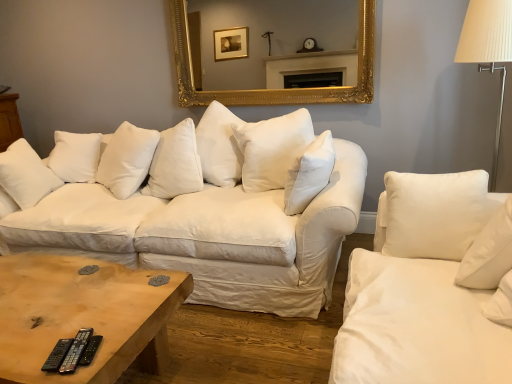
Consider the image. Measure the distance between wooden coffee table at center and camera.

wooden coffee table at center is 1.25 meters from camera.

What do you see at coordinates (127, 159) in the screenshot? This screenshot has height=384, width=512. I see `white soft pillow at center, the 1th pillow positioned from the left` at bounding box center [127, 159].

The image size is (512, 384). Describe the element at coordinates (90, 350) in the screenshot. I see `black plastic remote at lower left, which is counted as the 1th remote, starting from the right` at that location.

Describe the element at coordinates (273, 90) in the screenshot. The height and width of the screenshot is (384, 512). I see `gold ornate mirror at upper center` at that location.

Describe the element at coordinates (488, 50) in the screenshot. I see `white fabric lampshade at right` at that location.

Where is `wooden coffee table at center`? wooden coffee table at center is located at coordinates (83, 315).

How far apart are white fabric lampshade at right and wooden coffee table at center?

white fabric lampshade at right is 6.65 feet away from wooden coffee table at center.

Between white fabric lampshade at right and wooden coffee table at center, which one has smaller size?

Smaller between the two is white fabric lampshade at right.

Image resolution: width=512 pixels, height=384 pixels. In the image, there is a white fabric lampshade at right. In order to click on coffee table below it (from a real-world perspective) in this screenshot , I will do `click(83, 315)`.

Is white fabric lampshade at right situated inside wooden coffee table at center or outside?

white fabric lampshade at right is not inside wooden coffee table at center, it's outside.

Is white cotton couch at center placed right next to black rubber remote at lower left, the second remote in the right-to-left sequence?

white cotton couch at center and black rubber remote at lower left, the second remote in the right-to-left sequence, are clearly separated.

Based on the photo, is white cotton couch at center spatially inside black rubber remote at lower left, the second remote in the right-to-left sequence, or outside of it?

white cotton couch at center exists outside the volume of black rubber remote at lower left, the second remote in the right-to-left sequence.

Is white cotton couch at center wider than black rubber remote at lower left, arranged as the first remote when viewed from the left?

Correct, the width of white cotton couch at center exceeds that of black rubber remote at lower left, arranged as the first remote when viewed from the left.

Between white cotton couch at center and black rubber remote at lower left, arranged as the first remote when viewed from the left, which one is positioned behind?

white cotton couch at center.

Based on the photo, from the image's perspective, between black plastic remote at lower left, which is counted as the 1th remote, starting from the right, and white cotton couch at center, who is located below?

From the image's view, black plastic remote at lower left, which is counted as the 1th remote, starting from the right, is below.

Considering their positions, is black plastic remote at lower left, which is counted as the 1th remote, starting from the right, located in front of or behind white cotton couch at center?

Visually, black plastic remote at lower left, which is counted as the 1th remote, starting from the right, is located in front of white cotton couch at center.

Is black plastic remote at lower left, which ranks as the 2th remote in left-to-right order, aimed at white cotton couch at center?

No, black plastic remote at lower left, which ranks as the 2th remote in left-to-right order, is not facing towards white cotton couch at center.

You are a GUI agent. You are given a task and a screenshot of the screen. Output one action in this format:
    pyautogui.click(x=<x>, y=<y>)
    Task: Click on the studio couch on the left of black plastic remote at lower left, which ranks as the 2th remote in left-to-right order
    
    Given the screenshot: What is the action you would take?
    pyautogui.click(x=202, y=207)

Does white soft pillow at center, positioned as the 2th pillow in right-to-left order, come behind black plastic remote at lower left, which is counted as the 1th remote, starting from the right?

That is True.

Does white soft pillow at center, which appears as the 1th pillow when viewed from the back, turn towards black plastic remote at lower left, which is counted as the 1th remote, starting from the right?

No, white soft pillow at center, which appears as the 1th pillow when viewed from the back, is not turned towards black plastic remote at lower left, which is counted as the 1th remote, starting from the right.

From a real-world perspective, does white soft pillow at center, which is the second pillow from front to back, stand above black plastic remote at lower left, which ranks as the 2th remote in left-to-right order?

Yes, from a real-world perspective, white soft pillow at center, which is the second pillow from front to back, is above black plastic remote at lower left, which ranks as the 2th remote in left-to-right order.

Which is more to the left, white soft pillow at center, positioned as the 2th pillow in right-to-left order, or black plastic remote at lower left, which is counted as the 1th remote, starting from the right?

Positioned to the left is white soft pillow at center, positioned as the 2th pillow in right-to-left order.

From a real-world perspective, who is located higher, white cotton pillow at center, which is the 1th pillow from right to left, or white fabric lampshade at right?

white fabric lampshade at right, from a real-world perspective.

How distant is white cotton pillow at center, which is counted as the 2th pillow, starting from the left, from white fabric lampshade at right?

white cotton pillow at center, which is counted as the 2th pillow, starting from the left, and white fabric lampshade at right are 35.78 inches apart.

Between white cotton pillow at center, which is the 1th pillow from right to left, and white fabric lampshade at right, which one has larger width?

With larger width is white fabric lampshade at right.

Considering the sizes of objects white cotton pillow at center, which is the 1th pillow from right to left, and white fabric lampshade at right in the image provided, who is smaller, white cotton pillow at center, which is the 1th pillow from right to left, or white fabric lampshade at right?

Smaller between the two is white cotton pillow at center, which is the 1th pillow from right to left.

Identify the location of pillow that is the 2nd object located behind the white cotton couch at center. (127, 159).

Is white cotton couch at center positioned with its back to white soft pillow at center, which is the second pillow from front to back?

Yes.

Is white cotton couch at center bigger than white soft pillow at center, which is the second pillow from front to back?

Yes, white cotton couch at center is bigger than white soft pillow at center, which is the second pillow from front to back.

How far apart are white cotton couch at center and white soft pillow at center, which is the second pillow from front to back?

white cotton couch at center and white soft pillow at center, which is the second pillow from front to back, are 15.86 inches apart.

Which is in front, point (85, 338) or point (340, 101)?

Point (85, 338)

What are the coordinates of `remote that is the 2nd one when counting downward from the gold ornate mirror at upper center (from the image's perspective)` in the screenshot? It's located at (76, 351).

Is black rubber remote at lower left, arranged as the first remote when viewed from the left, positioned far away from gold ornate mirror at upper center?

Yes, black rubber remote at lower left, arranged as the first remote when viewed from the left, is far from gold ornate mirror at upper center.

Is black rubber remote at lower left, the second remote in the right-to-left sequence, thinner than gold ornate mirror at upper center?

No, black rubber remote at lower left, the second remote in the right-to-left sequence, is not thinner than gold ornate mirror at upper center.

Where is `coffee table on the left side of white fabric lampshade at right`? coffee table on the left side of white fabric lampshade at right is located at coordinates (83, 315).

Find the location of a particular element. This screenshot has height=384, width=512. remote that is the 2nd one when counting downward from the white cotton couch at center (from the image's perspective) is located at coordinates (76, 351).

When comparing their distances from black plastic remote at lower left, which ranks as the 2th remote in left-to-right order, does white soft pillow at center, which is the second pillow from front to back, or black rubber remote at lower left, the second remote in the right-to-left sequence, seem further?

white soft pillow at center, which is the second pillow from front to back, is further to black plastic remote at lower left, which ranks as the 2th remote in left-to-right order.

Considering their positions, is wooden coffee table at center positioned closer to gold ornate mirror at upper center than white cotton pillow at center, the 2th pillow viewed from the back?

white cotton pillow at center, the 2th pillow viewed from the back, lies closer to gold ornate mirror at upper center than the other object.

Based on their spatial positions, is gold ornate mirror at upper center or white soft pillow at center, which is the second pillow from front to back, closer to black rubber remote at lower left, the second remote in the right-to-left sequence?

white soft pillow at center, which is the second pillow from front to back, lies closer to black rubber remote at lower left, the second remote in the right-to-left sequence, than the other object.

When comparing their distances from white fabric lampshade at right, does white soft pillow at center, which is the second pillow from front to back, or gold ornate mirror at upper center seem further?

Based on the image, white soft pillow at center, which is the second pillow from front to back, appears to be further to white fabric lampshade at right.

From the image, which object appears to be farther from black rubber remote at lower left, arranged as the first remote when viewed from the left, white cotton couch at center or white cotton pillow at center, which is counted as the 2th pillow, starting from the left?

The object further to black rubber remote at lower left, arranged as the first remote when viewed from the left, is white cotton couch at center.

Looking at the image, which one is located closer to black plastic remote at lower left, which ranks as the 2th remote in left-to-right order, white cotton couch at center or white cotton pillow at center, which is the 1th pillow from right to left?

white cotton pillow at center, which is the 1th pillow from right to left, is closer to black plastic remote at lower left, which ranks as the 2th remote in left-to-right order.

Based on their spatial positions, is white fabric lampshade at right or black rubber remote at lower left, arranged as the first remote when viewed from the left, closer to black plastic remote at lower left, which is counted as the 1th remote, starting from the right?

black rubber remote at lower left, arranged as the first remote when viewed from the left.

From the image, which object appears to be farther from black plastic remote at lower left, which is counted as the 1th remote, starting from the right, wooden coffee table at center or white cotton couch at center?

white cotton couch at center is positioned further to the anchor black plastic remote at lower left, which is counted as the 1th remote, starting from the right.

In order to click on studio couch between black plastic remote at lower left, which ranks as the 2th remote in left-to-right order, and white soft pillow at center, which is the second pillow from front to back, from front to back in this screenshot , I will do `click(202, 207)`.

Locate an element on the screen. The width and height of the screenshot is (512, 384). studio couch located between white soft pillow at center, which appears as the 1th pillow when viewed from the back, and white fabric lampshade at right in the left-right direction is located at coordinates (202, 207).

I want to click on mirror between wooden coffee table at center and white fabric lampshade at right, so click(273, 90).

Find the location of a particular element. remote situated between black rubber remote at lower left, the second remote in the right-to-left sequence, and white cotton pillow at center, marked as the first pillow in a front-to-back arrangement, from left to right is located at coordinates (90, 350).